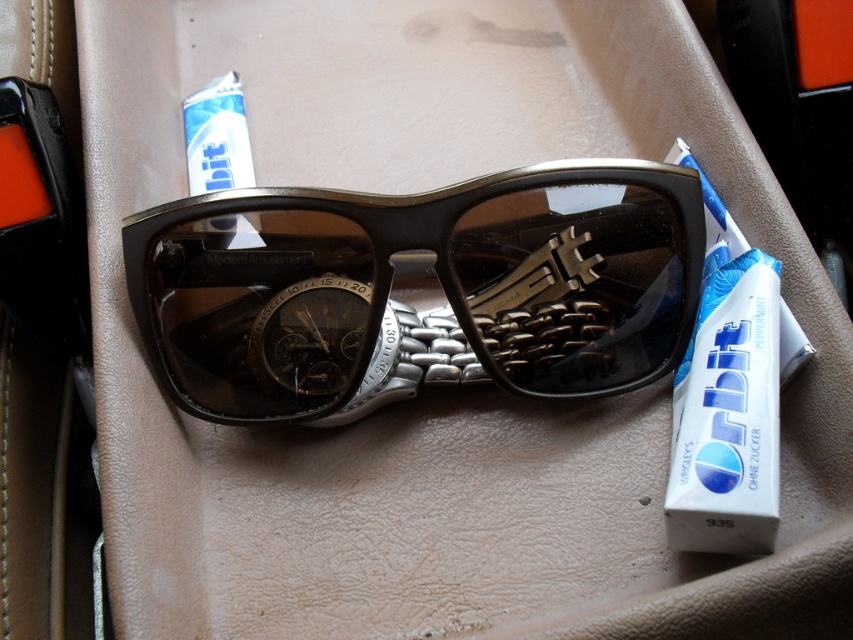
Can you confirm if matte black sunglasses at center is wider than white glossy tube at upper center?

Indeed, matte black sunglasses at center has a greater width compared to white glossy tube at upper center.

Can you confirm if matte black sunglasses at center is positioned to the right of white glossy tube at upper center?

Correct, you'll find matte black sunglasses at center to the right of white glossy tube at upper center.

Who is more distant from viewer, (270, 275) or (219, 186)?

The point (219, 186) is more distant.

Where is `matte black sunglasses at center`? matte black sunglasses at center is located at coordinates (419, 289).

Who is positioned more to the right, matte black sunglasses at center or white glossy toothpaste at right?

white glossy toothpaste at right is more to the right.

Between matte black sunglasses at center and white glossy toothpaste at right, which one has less height?

matte black sunglasses at center

Which is in front, point (302, 348) or point (759, 323)?

Point (759, 323)

I want to click on matte black sunglasses at center, so click(x=419, y=289).

How far apart are white glossy toothpaste at right and white glossy tube at upper center?

white glossy toothpaste at right is 65.33 centimeters away from white glossy tube at upper center.

Does white glossy toothpaste at right appear on the right side of white glossy tube at upper center?

Yes, white glossy toothpaste at right is to the right of white glossy tube at upper center.

Is point (753, 433) positioned behind point (209, 227)?

That is False.

The image size is (853, 640). Find the location of `white glossy toothpaste at right`. white glossy toothpaste at right is located at coordinates (730, 396).